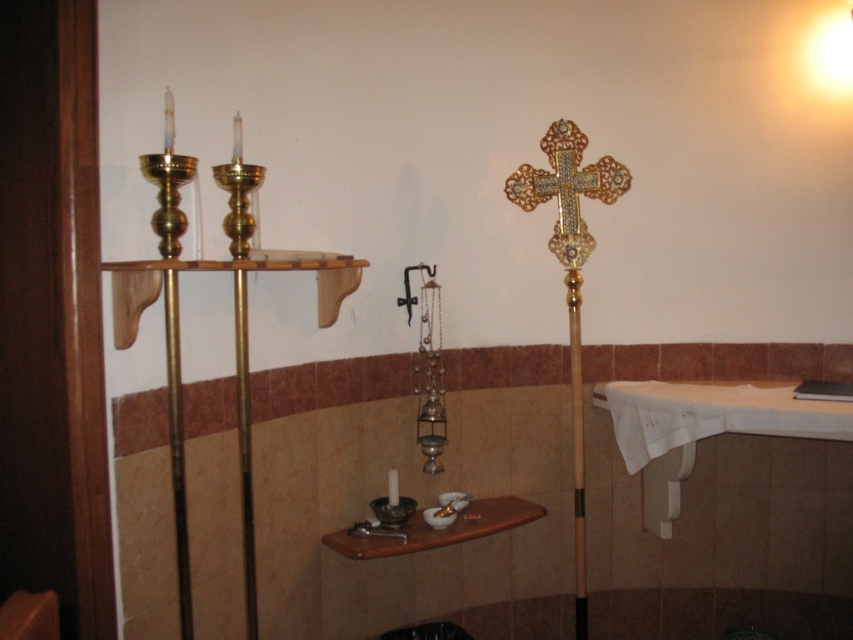
Identify the location of gold textured cross at right. The height and width of the screenshot is (640, 853). (570, 280).

In the scene shown: Can you confirm if gold textured cross at right is positioned below gold ornate cross at upper right?

Correct, gold textured cross at right is located below gold ornate cross at upper right.

Between gold textured cross at right and gold ornate cross at upper right, which one has more height?

gold textured cross at right

Consider the image. Who is more forward, (573, 524) or (608, 188)?

Point (608, 188) is more forward.

This screenshot has width=853, height=640. What are the coordinates of `gold textured cross at right` in the screenshot? It's located at (570, 280).

Does point (553, 173) come farther from viewer compared to point (395, 506)?

Yes, it is behind point (395, 506).

Is gold ornate cross at upper right below matte black candle holder at center?

Incorrect, gold ornate cross at upper right is not positioned below matte black candle holder at center.

Where is `gold ornate cross at upper right`? The image size is (853, 640). gold ornate cross at upper right is located at coordinates (567, 188).